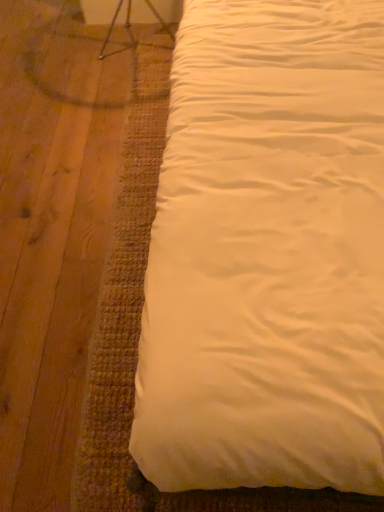
At what (x,y) coordinates should I click in order to perform the action: click on vacant area that lies in front of metallic silver swivel chair at upper left. Please return your answer as a coordinate pair (x, y). The width and height of the screenshot is (384, 512). Looking at the image, I should click on (119, 86).